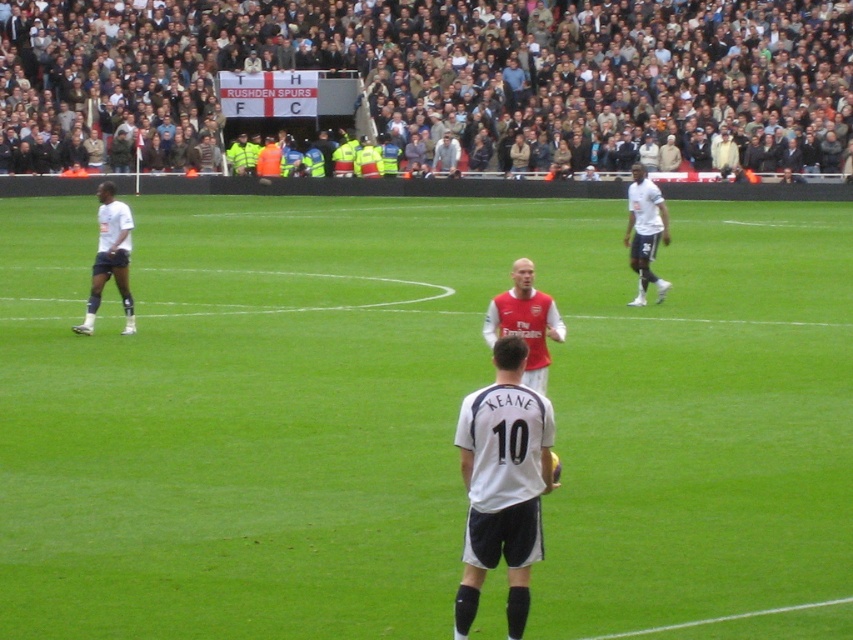
Does dark gray crowd at upper center appear on the left side of white jersey at center?

Yes, dark gray crowd at upper center is to the left of white jersey at center.

Between dark gray crowd at upper center and white jersey at center, which one has more height?

dark gray crowd at upper center is taller.

Image resolution: width=853 pixels, height=640 pixels. Describe the element at coordinates (445, 74) in the screenshot. I see `dark gray crowd at upper center` at that location.

Locate an element on the screen. The height and width of the screenshot is (640, 853). dark gray crowd at upper center is located at coordinates (445, 74).

Does green grass field at center appear over dark gray crowd at upper center?

No.

Which of these two, green grass field at center or dark gray crowd at upper center, stands shorter?

green grass field at center is shorter.

Is point (341, 212) closer to viewer compared to point (10, 61)?

Yes, point (341, 212) is closer to viewer.

The image size is (853, 640). I want to click on green grass field at center, so click(x=413, y=416).

Is point (521, 481) farther from camera compared to point (112, 214)?

No, it is not.

Who is higher up, white jersey at center or white matte shorts at left?

white matte shorts at left is above.

Is point (482, 429) less distant than point (99, 212)?

Yes, point (482, 429) is in front of point (99, 212).

Locate an element on the screen. Image resolution: width=853 pixels, height=640 pixels. white jersey at center is located at coordinates (502, 484).